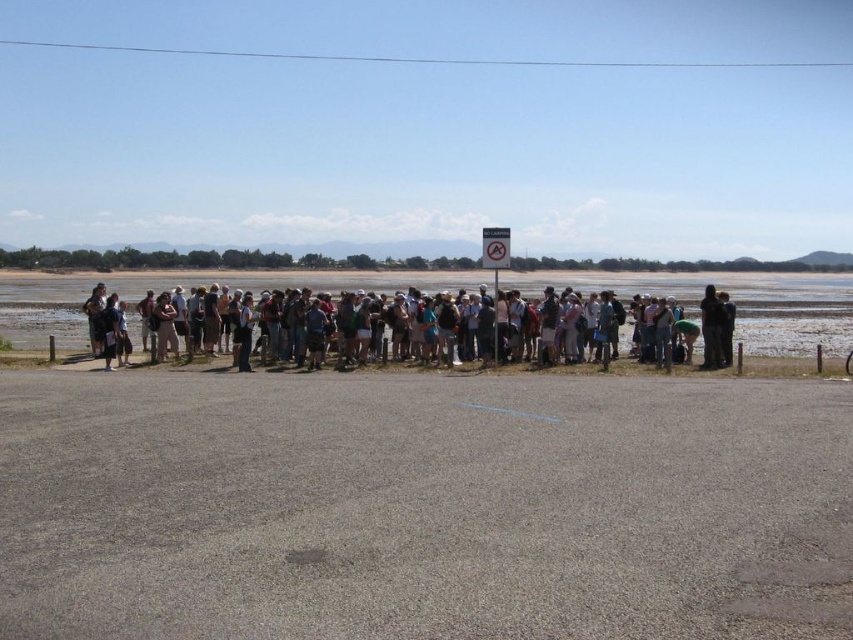
You are a photographer trying to capture a wide shot of the crowd in the parking area. You have a camera with a 50mm lens. Considering the distance between the clear blue sky at upper center and the matte black backpack at center, will this lens allow you to include both objects in the frame?

The clear blue sky at upper center is 135.59 meters from the matte black backpack at center. A 50mm lens has a moderate field of view, but given the significant distance between the two objects, it might not capture both in a single frame unless you are positioned far enough back. However, since the scene is a parking area with limited space, it might be challenging. Consider using a wider lens or adjusting your position for a better composition.